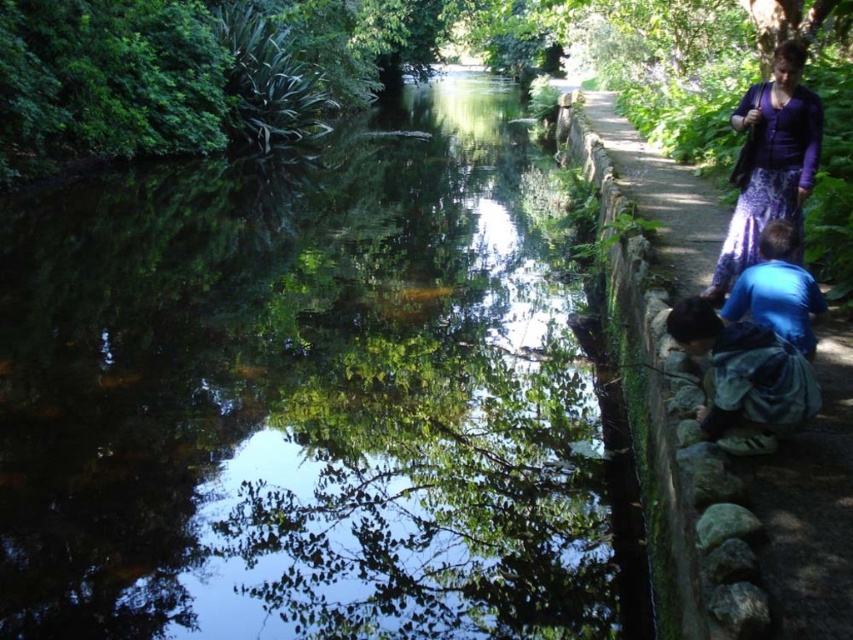
You are a photographer planning to capture a group photo of the purple fabric skirt at upper right and the blue matte shirt at lower right. Since you want both subjects to appear balanced in size in the photo, which subject should you move closer to the camera and which should you move further away?

The purple fabric skirt at upper right is bigger than the blue matte shirt at lower right. To balance their sizes in the photo, move the purple fabric skirt at upper right further away from the camera and bring the blue matte shirt at lower right closer to the camera.

You are a photographer trying to capture both the purple fabric skirt at upper right and the blue matte shirt at lower right in a single frame. Given that your camera has a fixed focal length and limited field of view, which subject should you prioritize positioning closer to the center of the frame to ensure both are visible without cropping?

Since the purple fabric skirt at upper right is wider than the blue matte shirt at lower right, you should position the purple fabric skirt at upper right closer to the center of the frame to accommodate its larger width while still fitting the blue matte shirt at lower right within the camera view.

You are a photographer positioned at the edge of the pathway. You want to take a photo that includes both the blue denim jacket at lower right and the purple fabric skirt at upper right. Which object should you adjust your camera angle to focus on first to ensure both are in frame?

The blue denim jacket at lower right is closer to the viewer than the purple fabric skirt at upper right, so you should focus on the blue denim jacket at lower right first to ensure both are in frame.